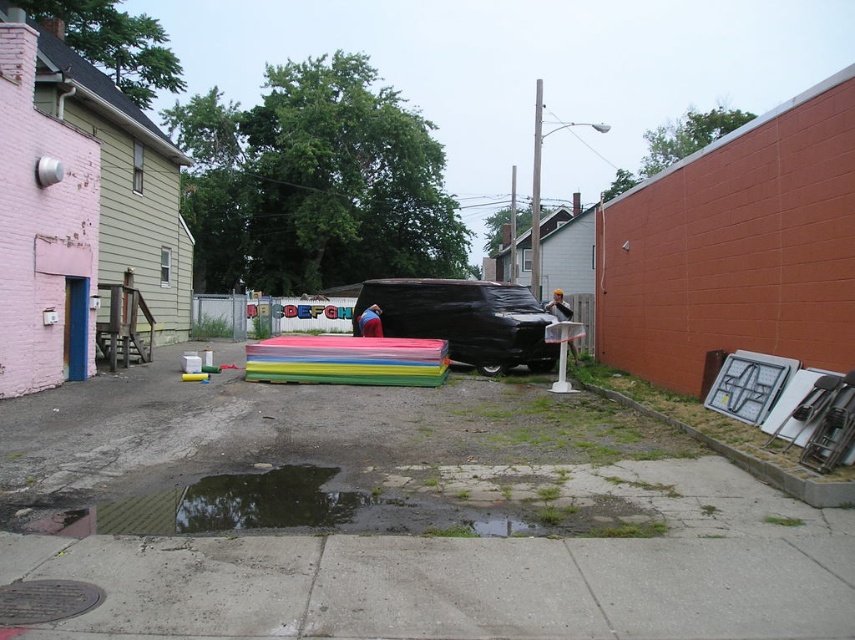
You are a delivery person trying to navigate through the alley. You see the black matte van at center and the brick at lower right. Which object is positioned higher from the ground?

The black matte van at center is above the brick at lower right, so it is positioned higher from the ground.

You are standing in the urban alleyway scene. There is a point marked at coordinates (399, 516). What object in the scene is located at this point?

The concrete pavement at center is located at the point marked by coordinates (399, 516).

In the scene shown: You are a delivery person trying to park your black matte van at center in the alleyway. The alley has a concrete pavement at center. Based on their widths, can your van fit on the pavement without overhanging?

The concrete pavement at center is wider than the black matte van at center, so the van can fit on the pavement without overhanging.